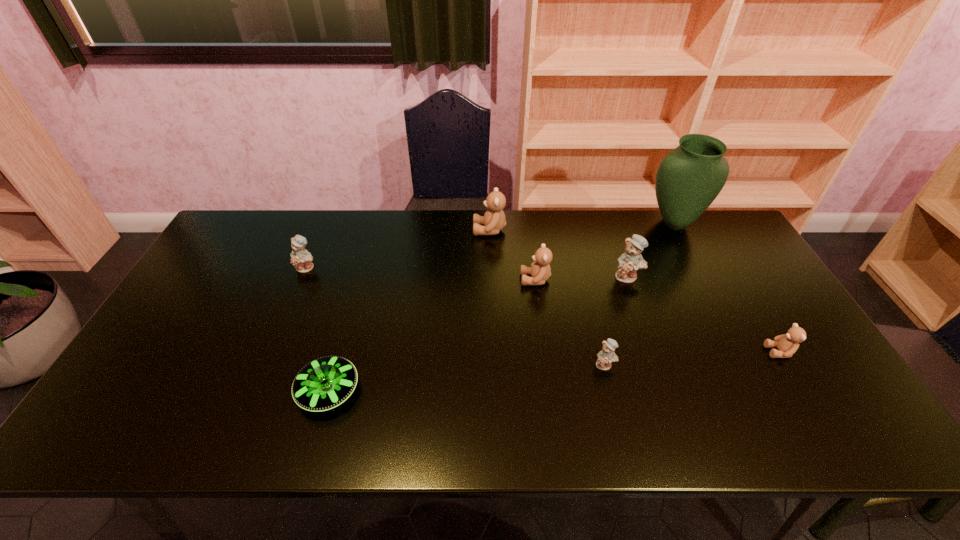
In order to click on vacant space located 0.330m on the front-facing side of the biggest blue teddy bear in this screenshot , I will do `click(662, 379)`.

In order to click on vacant space located 0.190m on the face of the fourth teddy bear from right to left in this screenshot , I will do `click(458, 280)`.

At what (x,y) coordinates should I click in order to perform the action: click on vacant point located 0.400m on the face of the fourth teddy bear from right to left. Please return your answer as a coordinate pair (x, y). Image resolution: width=960 pixels, height=540 pixels. Looking at the image, I should click on (389, 280).

Where is `free space located 0.130m on the face of the fourth teddy bear from right to left`? This screenshot has width=960, height=540. free space located 0.130m on the face of the fourth teddy bear from right to left is located at coordinates (478, 280).

At what (x,y) coordinates should I click in order to perform the action: click on free space located on the front-facing side of the second smallest blue teddy bear. Please return your answer as a coordinate pair (x, y). This screenshot has width=960, height=540. Looking at the image, I should click on (298, 291).

At what (x,y) coordinates should I click in order to perform the action: click on free space located on the face of the nearest brown teddy bear. Please return your answer as a coordinate pair (x, y). The height and width of the screenshot is (540, 960). Looking at the image, I should click on (712, 352).

Image resolution: width=960 pixels, height=540 pixels. I want to click on free location located 0.250m on the face of the nearest brown teddy bear, so [670, 352].

The height and width of the screenshot is (540, 960). Find the location of `vacant space located on the face of the nearest brown teddy bear`. vacant space located on the face of the nearest brown teddy bear is located at coordinates (716, 352).

Identify the location of free space located on the front-facing side of the second blue teddy bear from right to left. click(x=616, y=412).

I want to click on free location located on the right of the saucer, so click(389, 392).